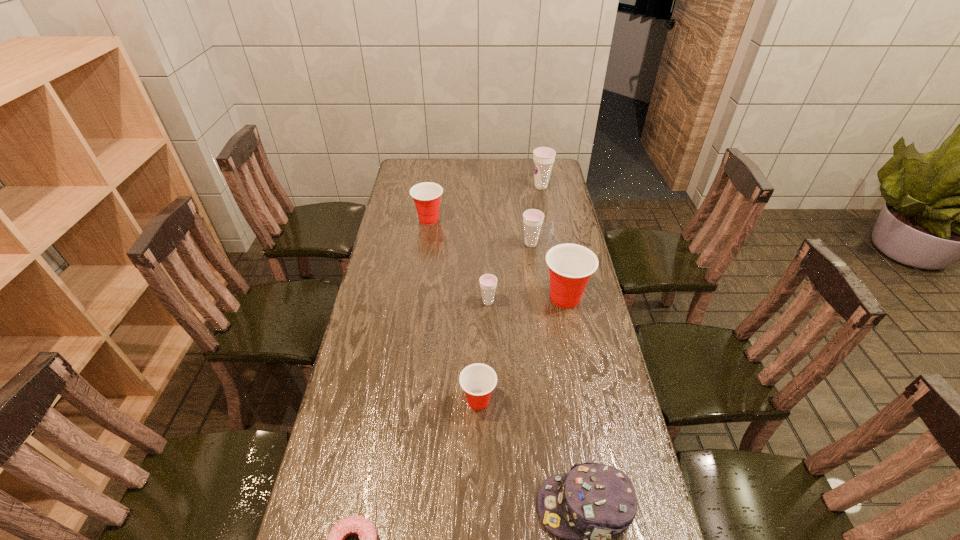
Locate an element on the screen. cup that stands as the fifth closest to the second farthest red cup is located at coordinates [x=543, y=157].

Find the location of a particular element. the second closest purple cup to the nearest purple cup is located at coordinates (543, 157).

This screenshot has width=960, height=540. In order to click on purple cup object that ranks as the second closest to the fifth nearest cup in this screenshot , I will do `click(543, 157)`.

Choose which red cup is the second nearest neighbor to the nearest red cup. Please provide its 2D coordinates. Your answer should be formatted as a tuple, i.e. [(x, y)], where the tuple contains the x and y coordinates of a point satisfying the conditions above.

[(426, 195)]

Identify the location of the second closest red cup relative to the smallest purple cup. The image size is (960, 540). (478, 380).

The width and height of the screenshot is (960, 540). Identify the location of vacant space that satisfies the following two spatial constraints: 1. on the back side of the nearest purple cup; 2. on the left side of the farthest object. (486, 186).